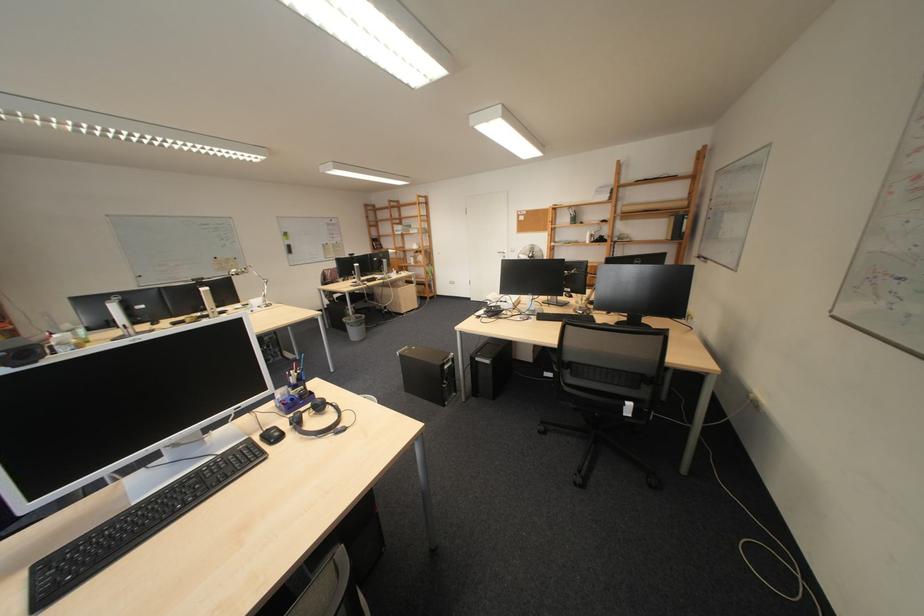
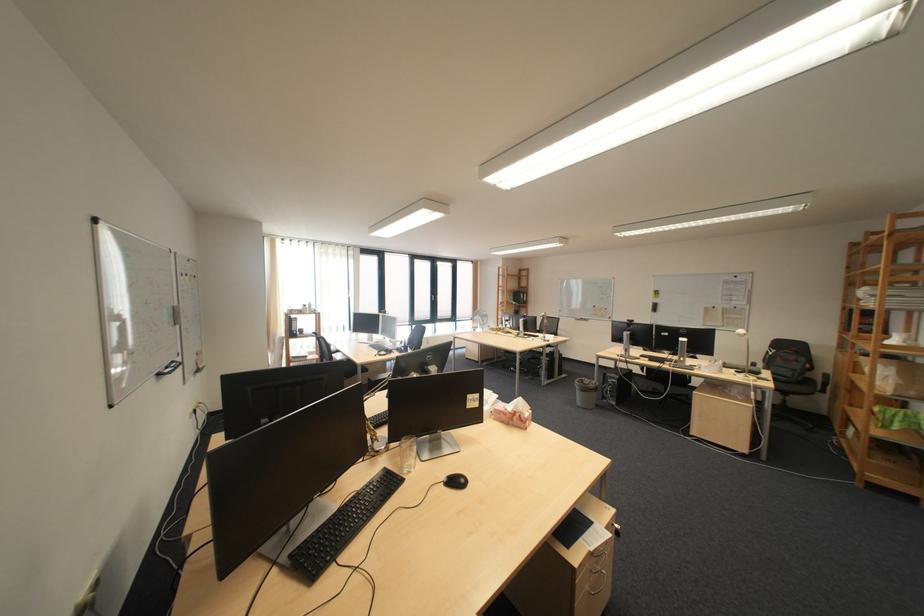
Find the pixel in the second image that matches pixel 229 259 in the first image.

(609, 308)